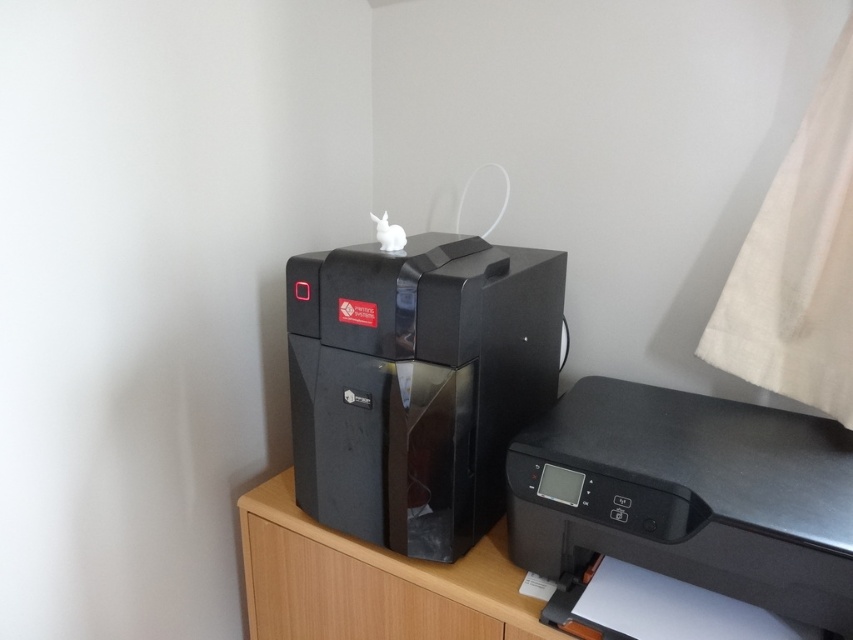
You need to place a 15 cm tall book on the cabinet between the black glossy printer at center and the wooden drawer at center. Considering their heights, which device should the book be placed on top of to ensure stability?

The black glossy printer at center has a greater height compared to wooden drawer at center, so placing the book on top of the black glossy printer at center would provide a more stable base due to its taller structure.

You are setting up a new printer in the room. The existing black glossy printer at center is placed at coordinates 0.600, 0.490. If the new printer must be placed 0.150 units to the right and 0.050 units higher than the existing one, what are the new coordinates?

The new coordinates would be 0.600 plus 0.150 equals 0.750 for the x coordinate, and 0.490 plus 0.050 equals 0.540 for the y coordinate. So the new printer should be placed at (460,480).